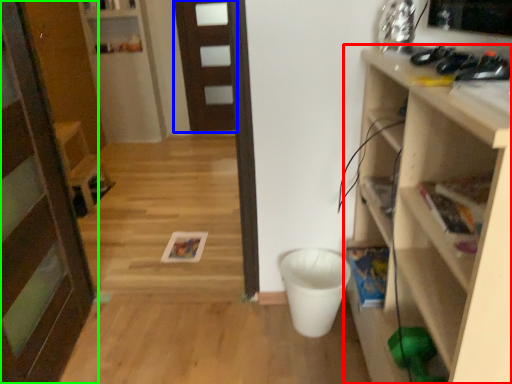
Question: Which object is positioned farthest from shelf (highlighted by a red box)? Select from door (highlighted by a blue box) and door (highlighted by a green box).

Choices:
 (A) door
 (B) door

Answer: (A)